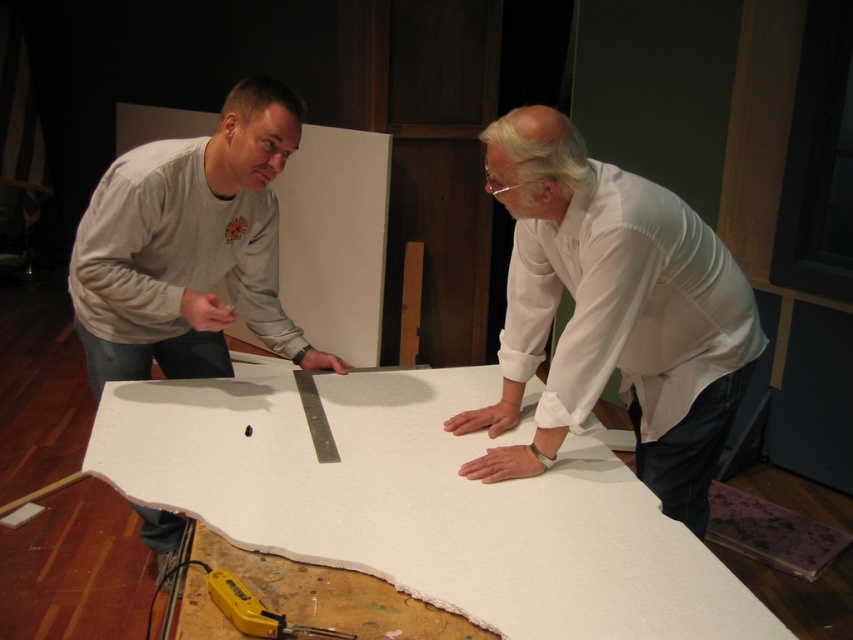
In the scene shown: Does white matte shirt at upper center appear under yellow plastic tool at lower center?

Actually, white matte shirt at upper center is above yellow plastic tool at lower center.

Between point (686, 435) and point (282, 630), which one is positioned in front?

Point (282, 630) is in front.

Where is `white matte shirt at upper center`? This screenshot has height=640, width=853. white matte shirt at upper center is located at coordinates [x=612, y=314].

Does white fabric at center have a greater width compared to gray cotton shirt at left?

Correct, the width of white fabric at center exceeds that of gray cotton shirt at left.

Is white fabric at center below gray cotton shirt at left?

Indeed, white fabric at center is positioned under gray cotton shirt at left.

Is point (374, 508) positioned before point (218, 332)?

Yes, point (374, 508) is closer to viewer.

You are a GUI agent. You are given a task and a screenshot of the screen. Output one action in this format:
    pyautogui.click(x=<x>, y=<y>)
    Task: Click on the white fabric at center
    
    Given the screenshot: What is the action you would take?
    pyautogui.click(x=422, y=502)

Is white fabric at center in front of yellow plastic tool at lower center?

That is False.

Who is taller, white fabric at center or yellow plastic tool at lower center?

white fabric at center

Is point (705, 548) closer to camera compared to point (231, 611)?

No, (705, 548) is further to viewer.

Where is `white fabric at center`? Image resolution: width=853 pixels, height=640 pixels. white fabric at center is located at coordinates (422, 502).